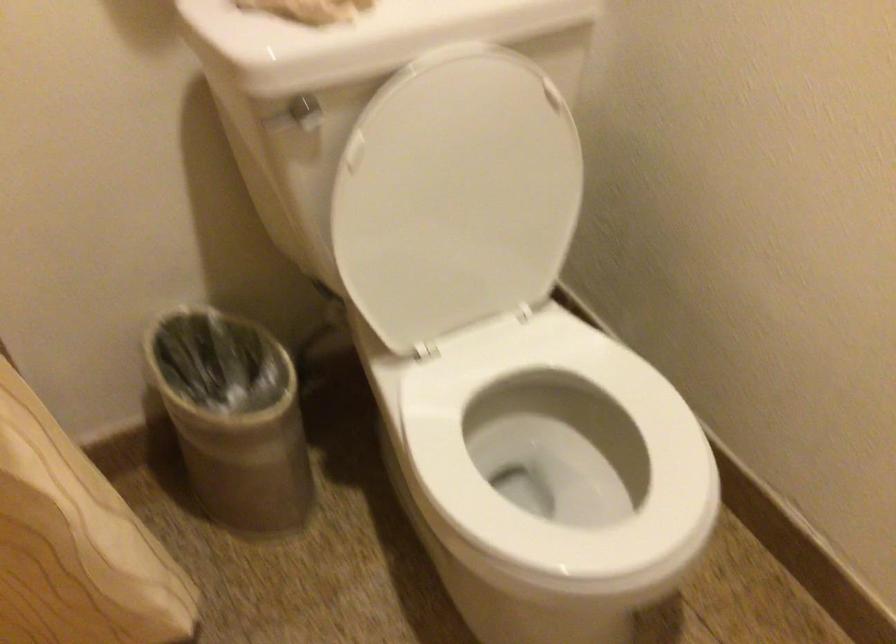
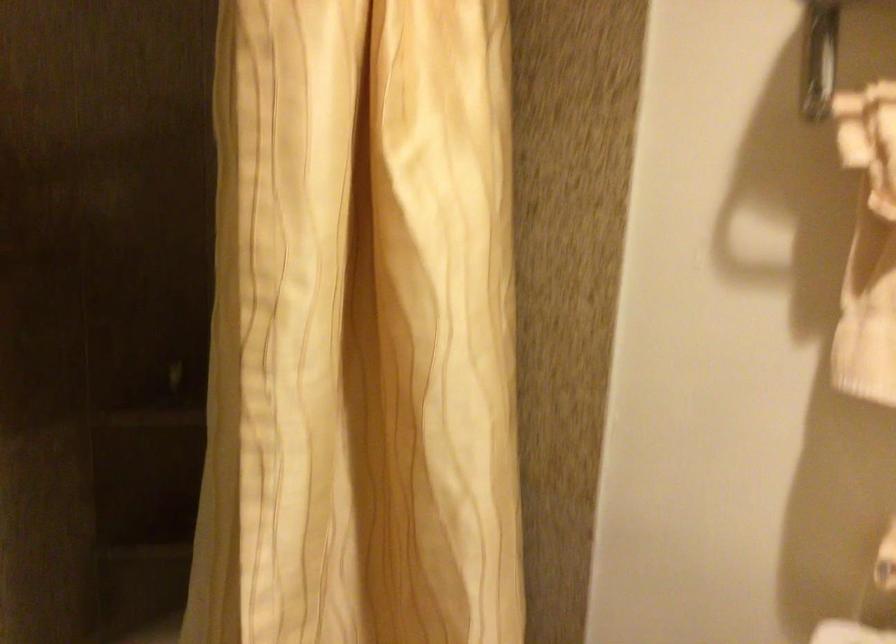
Question: How did the camera likely rotate?

Choices:
 (A) Left
 (B) Right
 (C) Up
 (D) Down

Answer: (A)